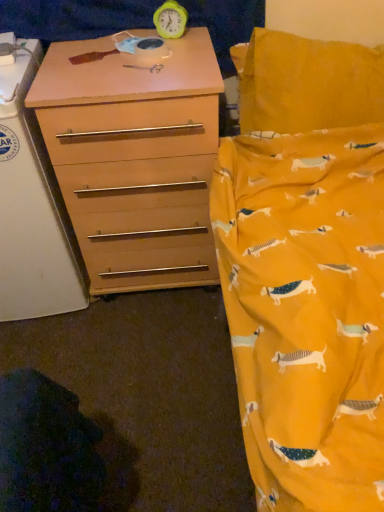
Question: Is matte wood chest of drawers at left thinner than green plastic clock at upper center?

Choices:
 (A) yes
 (B) no

Answer: (B)

Question: Is matte wood chest of drawers at left completely or partially outside of green plastic clock at upper center?

Choices:
 (A) yes
 (B) no

Answer: (A)

Question: Considering the relative positions of matte wood chest of drawers at left and green plastic clock at upper center in the image provided, is matte wood chest of drawers at left in front of green plastic clock at upper center?

Choices:
 (A) no
 (B) yes

Answer: (B)

Question: Is matte wood chest of drawers at left wider than green plastic clock at upper center?

Choices:
 (A) no
 (B) yes

Answer: (B)

Question: Are matte wood chest of drawers at left and green plastic clock at upper center far apart?

Choices:
 (A) no
 (B) yes

Answer: (A)

Question: Is matte wood chest of drawers at left shorter than green plastic clock at upper center?

Choices:
 (A) yes
 (B) no

Answer: (B)

Question: Is green plastic clock at upper center to the right of matte wood chest of drawers at left from the viewer's perspective?

Choices:
 (A) yes
 (B) no

Answer: (A)

Question: Is green plastic clock at upper center at the left side of matte wood chest of drawers at left?

Choices:
 (A) yes
 (B) no

Answer: (B)

Question: Does green plastic clock at upper center have a lesser height compared to matte wood chest of drawers at left?

Choices:
 (A) no
 (B) yes

Answer: (B)

Question: Does green plastic clock at upper center contain matte wood chest of drawers at left?

Choices:
 (A) no
 (B) yes

Answer: (A)

Question: Is green plastic clock at upper center taller than matte wood chest of drawers at left?

Choices:
 (A) no
 (B) yes

Answer: (A)

Question: From the image's perspective, is green plastic clock at upper center located beneath matte wood chest of drawers at left?

Choices:
 (A) no
 (B) yes

Answer: (A)

Question: Does matte wood changing table at left have a smaller size compared to matte wood chest of drawers at left?

Choices:
 (A) yes
 (B) no

Answer: (A)